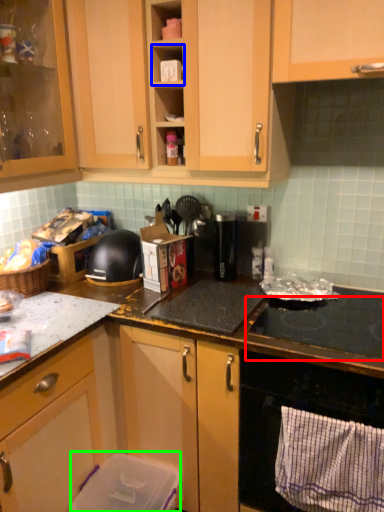
Question: Which object is the closest to the gas stove (highlighted by a red box)? Choose among these: shelf (highlighted by a blue box) or appliance (highlighted by a green box).

Choices:
 (A) shelf
 (B) appliance

Answer: (B)